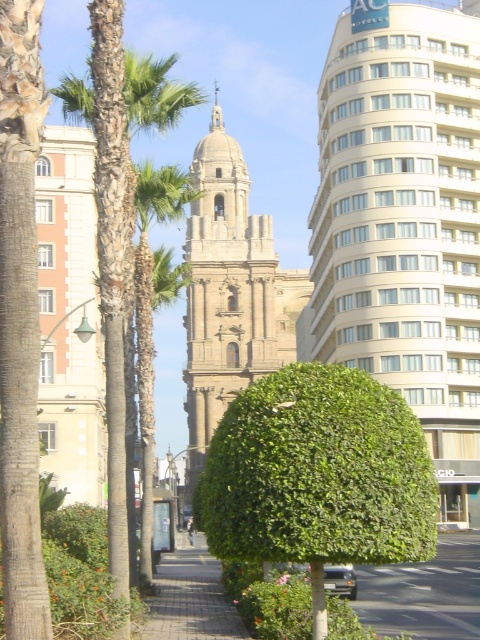
Who is more forward, [219,376] or [86,120]?

Point [86,120] is more forward.

Measure the distance between light beige stone bell tower at center and green leafy palm tree at left.

light beige stone bell tower at center and green leafy palm tree at left are 102.84 meters apart.

Locate an element on the screen. The image size is (480, 640). light beige stone bell tower at center is located at coordinates (230, 291).

At what (x,y) coordinates should I click in order to perform the action: click on light beige stone bell tower at center. Please return your answer as a coordinate pair (x, y). Looking at the image, I should click on (230, 291).

Is white glass building at center behind green leafy tree at left?

Yes, white glass building at center is further from the viewer.

The image size is (480, 640). Describe the element at coordinates (404, 227) in the screenshot. I see `white glass building at center` at that location.

This screenshot has height=640, width=480. Find the location of `white glass building at center`. white glass building at center is located at coordinates (404, 227).

Is point (433, 92) positioned behind point (207, 616)?

Yes, point (433, 92) is farther from viewer.

Measure the distance from white glass building at center to paved brick sidewalk at center.

The distance of white glass building at center from paved brick sidewalk at center is 28.60 meters.

Is point (472, 408) less distant than point (201, 636)?

No, (472, 408) is further to viewer.

The image size is (480, 640). What are the coordinates of `white glass building at center` in the screenshot? It's located at (404, 227).